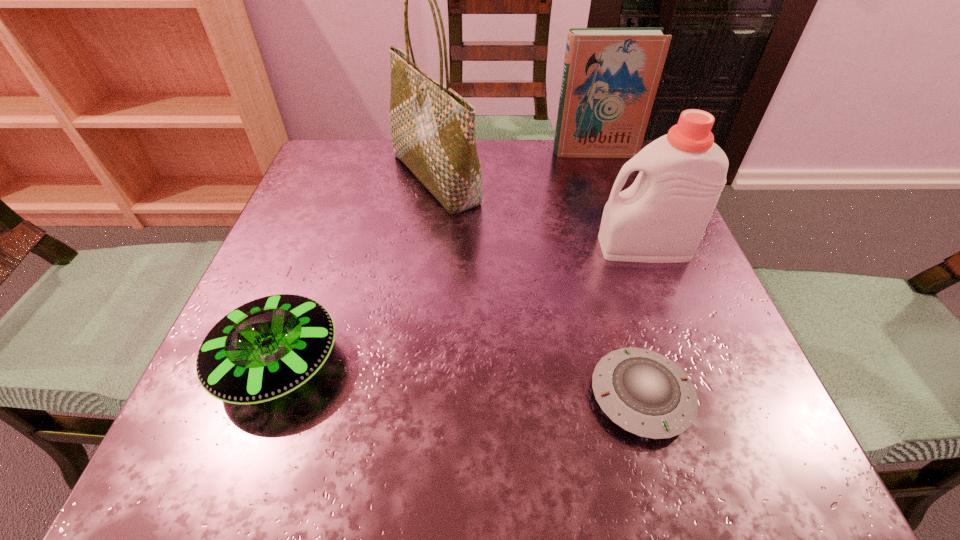
Where is `saucer that is positioned at the right edge`? This screenshot has width=960, height=540. saucer that is positioned at the right edge is located at coordinates (643, 392).

The height and width of the screenshot is (540, 960). Identify the location of object at the near left corner. (265, 349).

Identify the location of object that is at the far right corner. (610, 77).

The height and width of the screenshot is (540, 960). Identify the location of object that is at the near right corner. (643, 392).

The image size is (960, 540). Find the location of `vacant space at the far edge`. vacant space at the far edge is located at coordinates (420, 200).

The height and width of the screenshot is (540, 960). Find the location of `free space at the left edge`. free space at the left edge is located at coordinates (288, 237).

This screenshot has width=960, height=540. Identify the location of vacant region at the right edge of the desktop. (712, 333).

Identify the location of blank region between the detergent and the second object from left to right. (540, 213).

The image size is (960, 540). I want to click on free area in between the taller saucer and the shortest object, so click(460, 379).

The width and height of the screenshot is (960, 540). Identify the location of blank region between the third nearest object and the shopping bag. (540, 213).